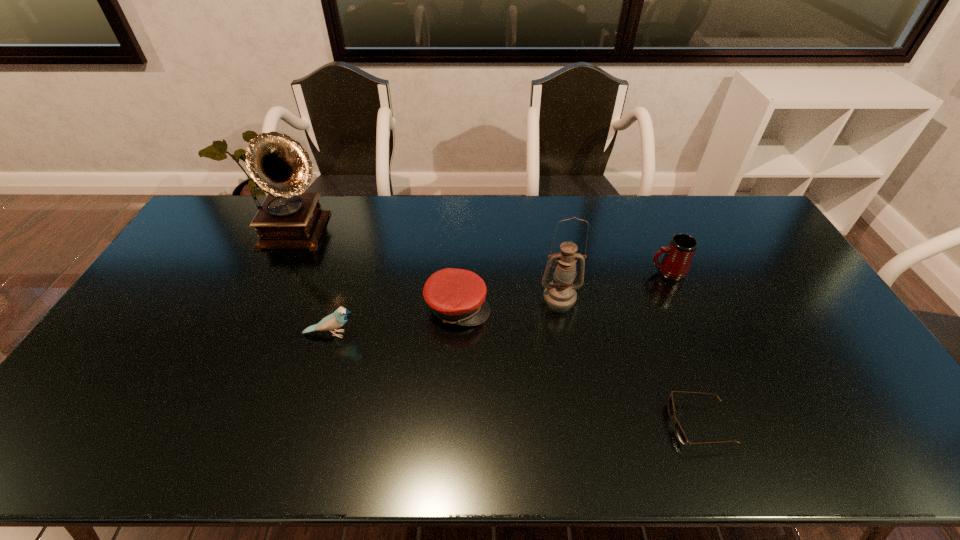
The image size is (960, 540). In order to click on vacant region located 0.200m on the horn of the record player in this screenshot , I will do (x=390, y=234).

The image size is (960, 540). I want to click on free space located on the back of the second tallest object, so click(549, 230).

This screenshot has width=960, height=540. In order to click on free space located on the side of the mug with the handle in this screenshot , I will do `click(535, 272)`.

Locate an element on the screen. The width and height of the screenshot is (960, 540). vacant space situated on the side of the mug with the handle is located at coordinates (588, 272).

Where is `free location located on the side of the mug with the handle`? The image size is (960, 540). free location located on the side of the mug with the handle is located at coordinates (575, 272).

Identify the location of free space located at the face of the bird. The height and width of the screenshot is (540, 960). (493, 334).

Find the location of a particular element. This screenshot has width=960, height=540. free space located 0.280m on the front of the fifth tallest object with an emblem is located at coordinates (584, 307).

Identify the location of vacant space located 0.200m on the lenses of the shortest object. (588, 424).

The height and width of the screenshot is (540, 960). I want to click on free point located 0.330m on the lenses of the shortest object, so click(534, 424).

At what (x,y) coordinates should I click in order to perform the action: click on vacant position located on the lenses of the shortest object. Please return your answer as a coordinate pair (x, y). Image resolution: width=960 pixels, height=540 pixels. Looking at the image, I should click on (580, 424).